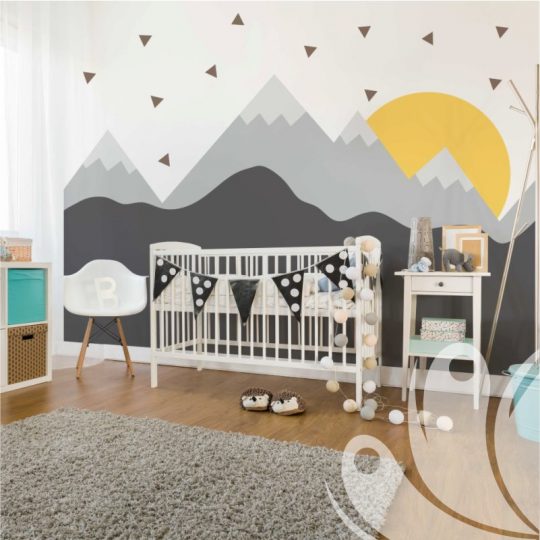
Where is `slippers`? This screenshot has height=540, width=540. slippers is located at coordinates (279, 402), (254, 399).